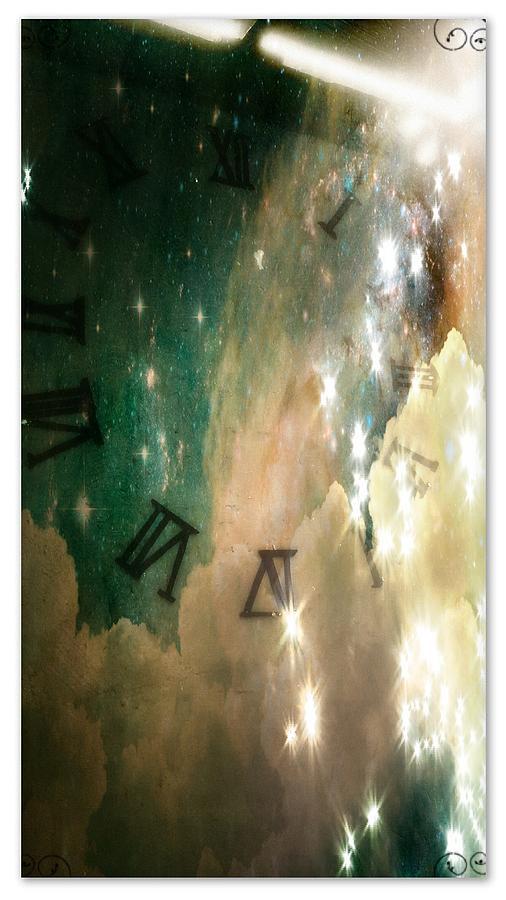
Identify the location of light reflections. This screenshot has height=900, width=506. (311, 725), (285, 624), (365, 819), (429, 702), (419, 662), (403, 471), (376, 345), (388, 277).